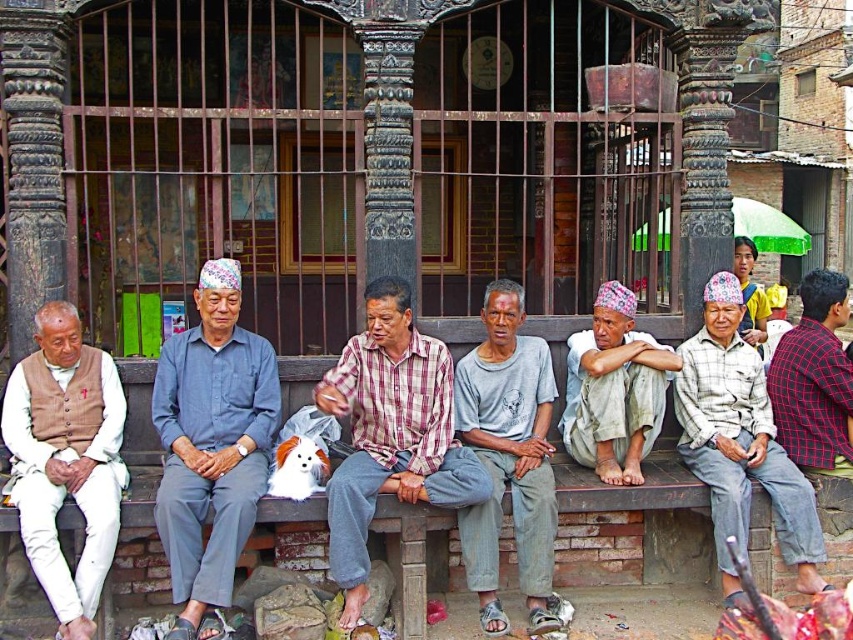
Question: Can you confirm if gray cotton shirt at center is positioned to the right of light gray cotton shirt at center?

Choices:
 (A) yes
 (B) no

Answer: (B)

Question: Which is farther from the plaid cotton shirt at center?

Choices:
 (A) light gray cotton shirt at center
 (B) plaid fabric shirt at center

Answer: (B)

Question: Which is farther from the gray cotton shirt at center?

Choices:
 (A) white cotton shirt at center
 (B) brown wooden bench at center
 (C) light brown fabric vest at left

Answer: (C)

Question: Does blue cotton shirt at left lie in front of red plaid shirt at center?

Choices:
 (A) no
 (B) yes

Answer: (B)

Question: Considering the real-world distances, which object is farthest from the brown wooden bench at center?

Choices:
 (A) plaid fabric shirt at center
 (B) light brown fabric vest at left
 (C) white cotton shirt at center
 (D) gray cotton shirt at center

Answer: (B)

Question: Is blue cotton shirt at left bigger than red plaid shirt at center?

Choices:
 (A) yes
 (B) no

Answer: (A)